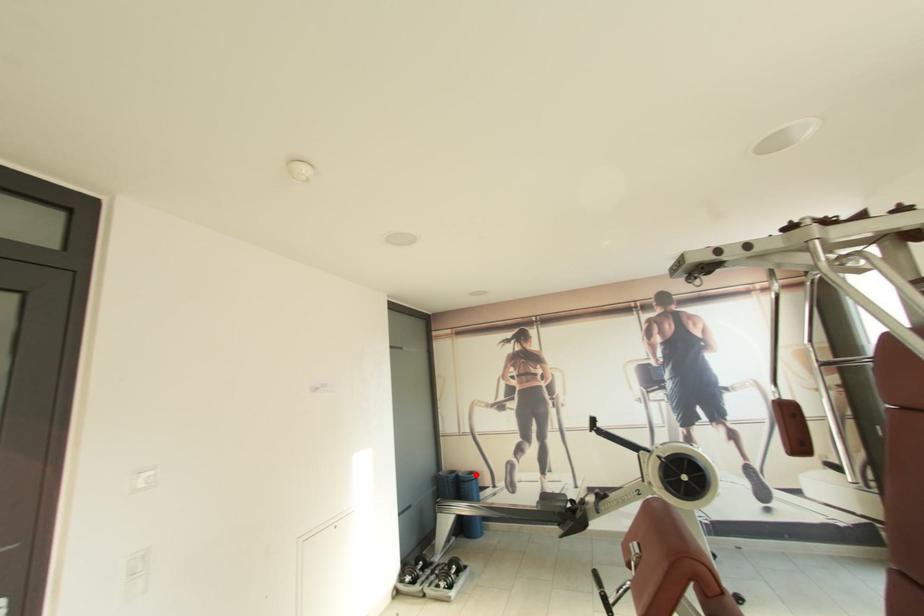
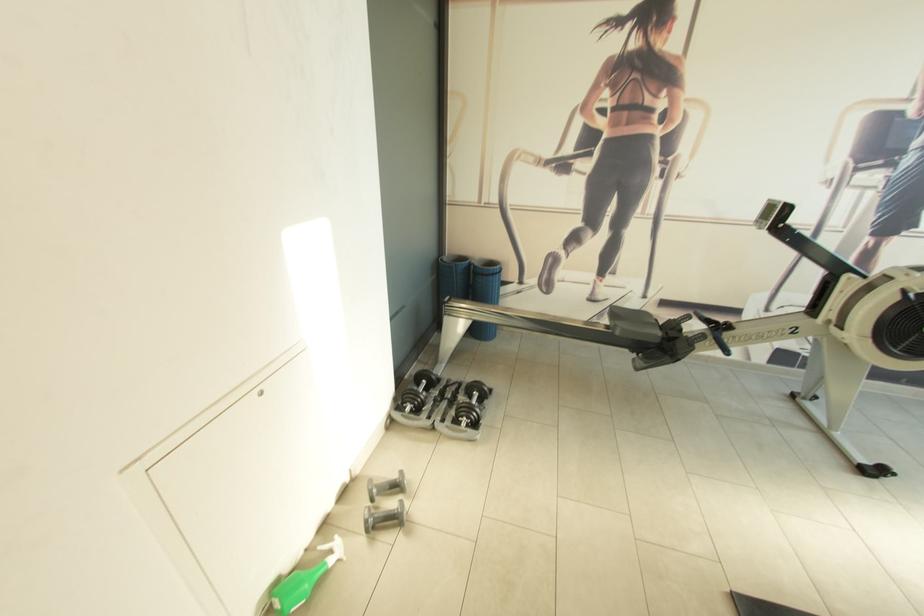
Question: I am providing you with two images of the same scene from different viewpoints. Given a red point in image1, look at the same physical point in image2. Is it:

Choices:
 (A) Closer to the viewpoint
 (B) Farther from the viewpoint

Answer: (A)